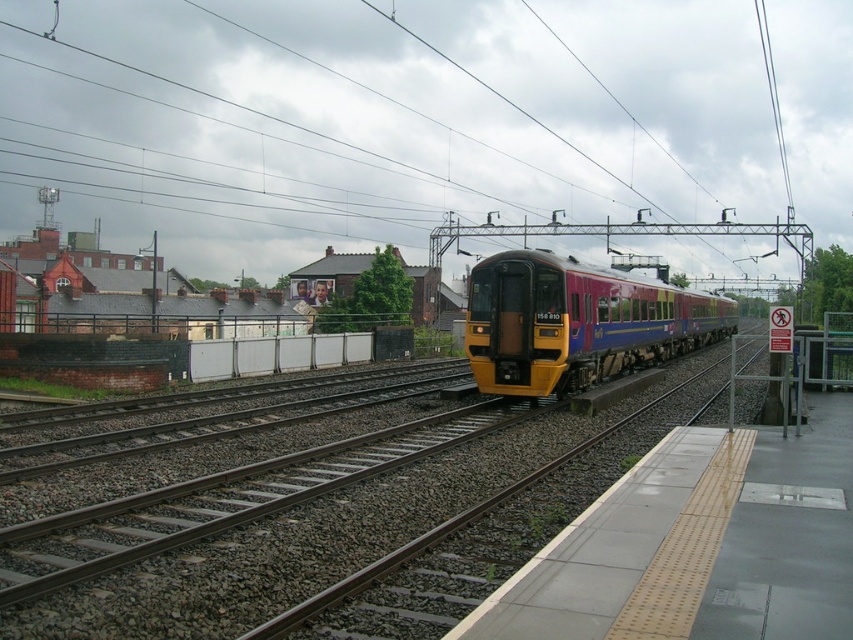
Which is more to the left, metallic wires at upper center or yellow metallic train at center?

metallic wires at upper center

Which of these two, metallic wires at upper center or yellow metallic train at center, stands shorter?

yellow metallic train at center is shorter.

Between point (660, 17) and point (525, 380), which one is positioned in front?

Point (525, 380) is more forward.

The height and width of the screenshot is (640, 853). I want to click on metallic wires at upper center, so click(x=413, y=120).